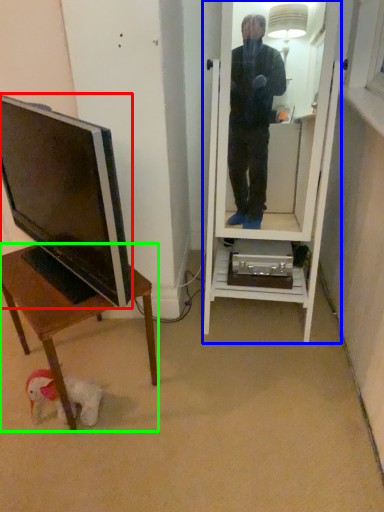
Question: Which object is positioned closest to television (highlighted by a red box)? Select from mirror (highlighted by a blue box) and desk (highlighted by a green box).

Choices:
 (A) mirror
 (B) desk

Answer: (B)